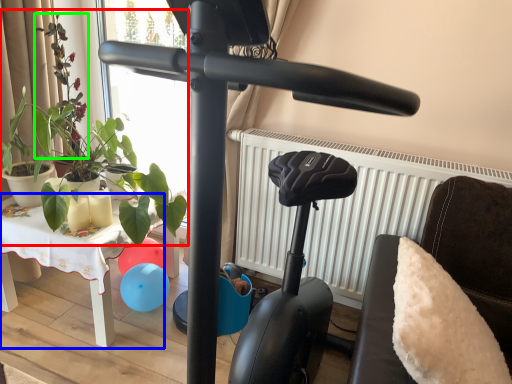
Question: Which object is the farthest from plant (highlighted by a red box)? Choose among these: table (highlighted by a blue box) or plant (highlighted by a green box).

Choices:
 (A) table
 (B) plant

Answer: (A)